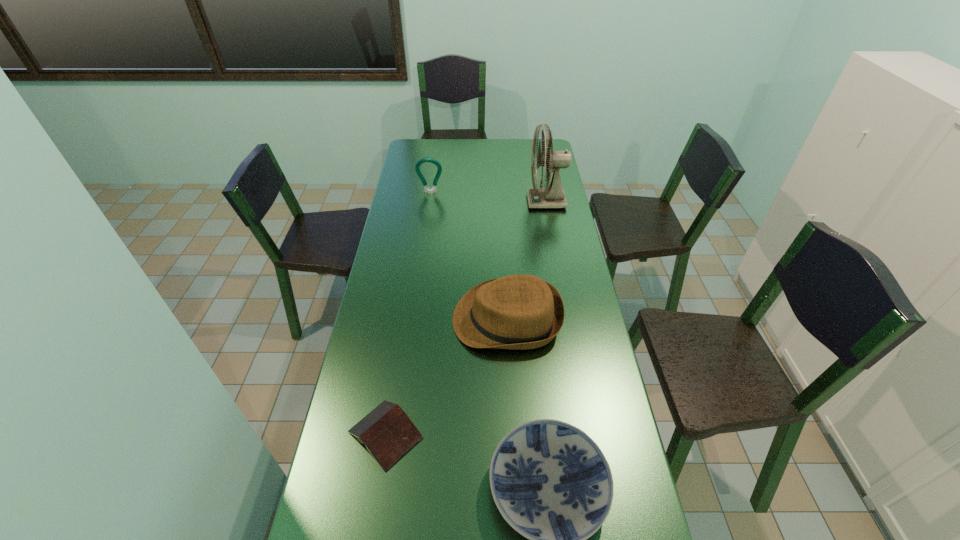
You are a GUI agent. You are given a task and a screenshot of the screen. Output one action in this format:
    pyautogui.click(x=<x>, y=<y>)
    Task: Click on the vacant space at the far left corner of the desktop
    This screenshot has width=960, height=540.
    Given the screenshot: What is the action you would take?
    pyautogui.click(x=406, y=151)

This screenshot has height=540, width=960. Identify the location of free space between the fan and the third tallest object. (527, 260).

In order to click on free space that is in between the bottle opener and the third nearest object in this screenshot , I will do `click(468, 256)`.

Locate an element on the screen. The image size is (960, 540). free space between the second tallest object and the third farthest object is located at coordinates (468, 256).

I want to click on object that is the second closest to the book, so click(550, 481).

Find the location of a particular element. The image size is (960, 540). the second closest object to the book is located at coordinates (550, 481).